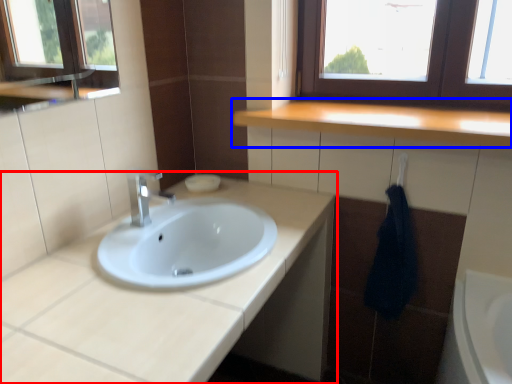
Question: Which object appears farthest to the camera in this image, bathroom cabinet (highlighted by a red box) or countertop (highlighted by a blue box)?

Choices:
 (A) bathroom cabinet
 (B) countertop

Answer: (B)